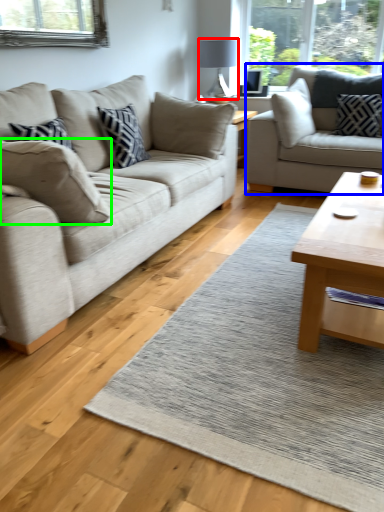
Question: Which object is the closest to the lamp (highlighted by a red box)? Choose among these: studio couch (highlighted by a blue box) or pillow (highlighted by a green box).

Choices:
 (A) studio couch
 (B) pillow

Answer: (A)